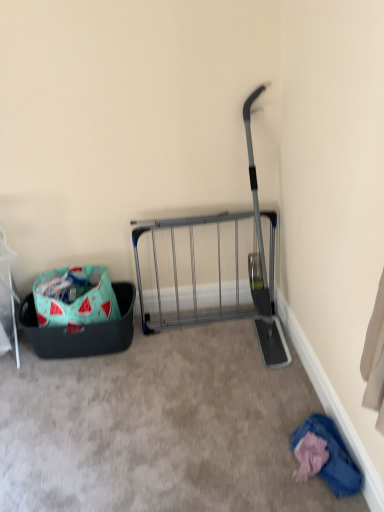
Question: Can you confirm if watermelon-patterned fabric bag at lower left is thinner than blue cotton shirt at lower right?

Choices:
 (A) yes
 (B) no

Answer: (B)

Question: Is watermelon-patterned fabric bag at lower left completely or partially outside of blue cotton shirt at lower right?

Choices:
 (A) no
 (B) yes

Answer: (B)

Question: Is watermelon-patterned fabric bag at lower left positioned with its back to blue cotton shirt at lower right?

Choices:
 (A) yes
 (B) no

Answer: (B)

Question: Does watermelon-patterned fabric bag at lower left touch blue cotton shirt at lower right?

Choices:
 (A) no
 (B) yes

Answer: (A)

Question: From a real-world perspective, is watermelon-patterned fabric bag at lower left on top of blue cotton shirt at lower right?

Choices:
 (A) no
 (B) yes

Answer: (B)

Question: Looking at the image, does teal fabric laundry basket at lower left seem bigger or smaller compared to blue cotton shirt at lower right?

Choices:
 (A) big
 (B) small

Answer: (A)

Question: From the image's perspective, relative to blue cotton shirt at lower right, is teal fabric laundry basket at lower left above or below?

Choices:
 (A) above
 (B) below

Answer: (A)

Question: Considering their positions, is teal fabric laundry basket at lower left located in front of or behind blue cotton shirt at lower right?

Choices:
 (A) front
 (B) behind

Answer: (B)

Question: From a real-world perspective, is teal fabric laundry basket at lower left above or below blue cotton shirt at lower right?

Choices:
 (A) above
 (B) below

Answer: (A)

Question: Is blue cotton shirt at lower right to the left or to the right of teal fabric laundry basket at lower left in the image?

Choices:
 (A) left
 (B) right

Answer: (B)

Question: From a real-world perspective, is blue cotton shirt at lower right physically located above or below teal fabric laundry basket at lower left?

Choices:
 (A) below
 (B) above

Answer: (A)

Question: Considering their positions, is blue cotton shirt at lower right located in front of or behind teal fabric laundry basket at lower left?

Choices:
 (A) behind
 (B) front

Answer: (B)

Question: Does point (331, 472) appear closer or farther from the camera than point (117, 337)?

Choices:
 (A) closer
 (B) farther

Answer: (A)

Question: Would you say blue cotton shirt at lower right is to the left or to the right of watermelon-patterned fabric bag at lower left in the picture?

Choices:
 (A) left
 (B) right

Answer: (B)

Question: Is point (337, 454) closer or farther from the camera than point (46, 281)?

Choices:
 (A) farther
 (B) closer

Answer: (B)